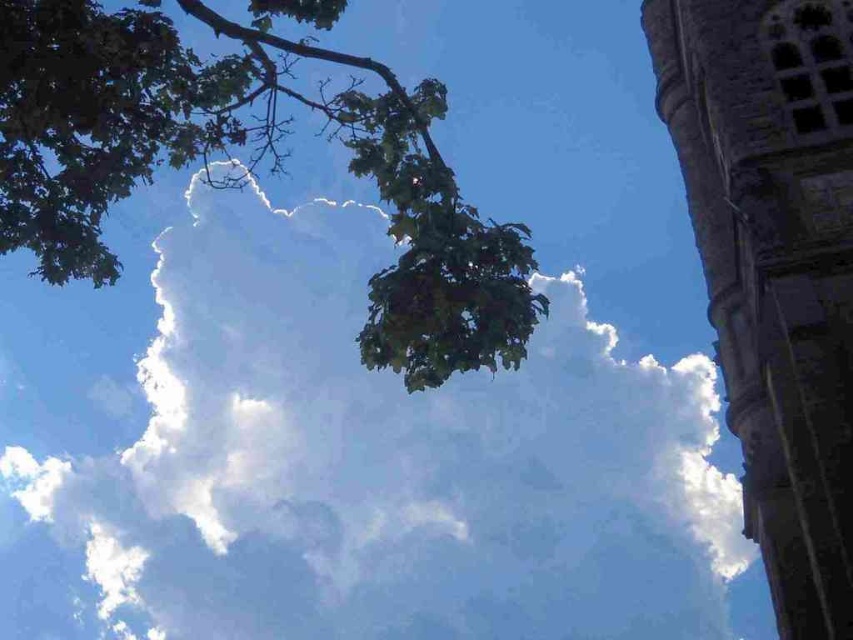
Question: Where is white fluffy cloud at upper center located in relation to green leafy tree at upper left in the image?

Choices:
 (A) above
 (B) below

Answer: (B)

Question: Which object is farther from the camera taking this photo?

Choices:
 (A) green leafy tree at upper left
 (B) stone tower at upper right

Answer: (B)

Question: Which object is positioned farthest from the white fluffy cloud at upper center?

Choices:
 (A) green leafy tree at upper left
 (B) stone tower at upper right

Answer: (B)

Question: Which object is positioned farthest from the green leafy tree at upper left?

Choices:
 (A) stone tower at upper right
 (B) white fluffy cloud at upper center

Answer: (B)

Question: Is the position of green leafy tree at upper left less distant than that of stone tower at upper right?

Choices:
 (A) no
 (B) yes

Answer: (B)

Question: Does white fluffy cloud at upper center come in front of green leafy tree at upper left?

Choices:
 (A) no
 (B) yes

Answer: (A)